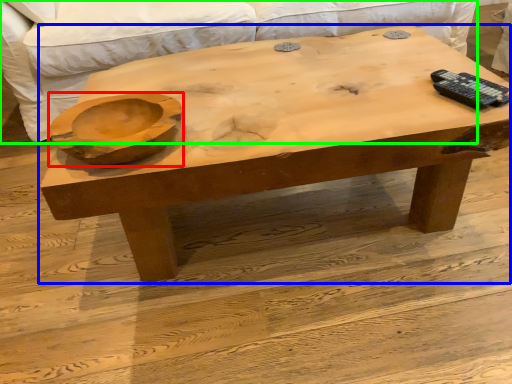
Question: Which is farther away from bowl (highlighted by a red box)? coffee table (highlighted by a blue box) or couch (highlighted by a green box)?

Choices:
 (A) coffee table
 (B) couch

Answer: (B)